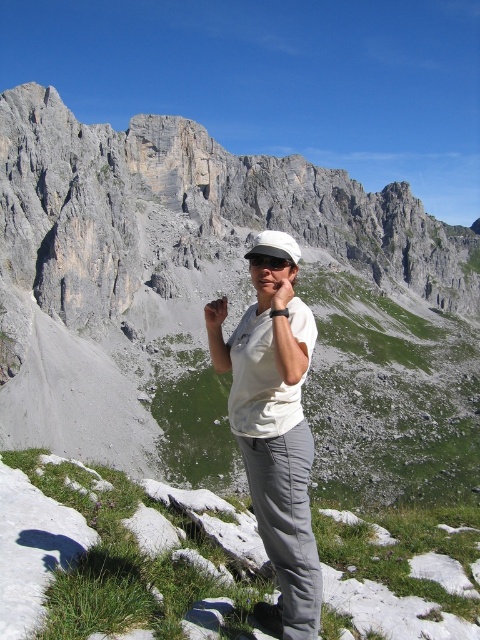
Question: Does gray rock mountain at center have a larger size compared to black matte goggles at center?

Choices:
 (A) yes
 (B) no

Answer: (A)

Question: Which point is closer to the camera taking this photo?

Choices:
 (A) [276, 300]
 (B) [268, 400]

Answer: (B)

Question: Does gray rock mountain at center appear on the left side of matte white hand at center?

Choices:
 (A) no
 (B) yes

Answer: (A)

Question: Among these points, which one is nearest to the camera?

Choices:
 (A) (299, 257)
 (B) (290, 273)
 (C) (224, 296)

Answer: (A)

Question: From the image, what is the correct spatial relationship of white matte baseball cap at center in relation to black matte goggles at center?

Choices:
 (A) right
 (B) left

Answer: (A)

Question: Which point appears farthest from the camera in this image?

Choices:
 (A) (64, 308)
 (B) (285, 301)

Answer: (A)